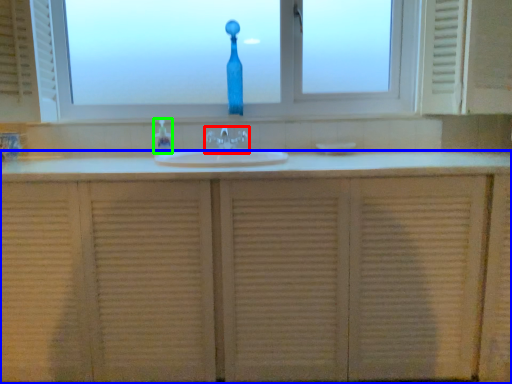
Question: Estimate the real-world distances between objects in this image. Which object is farther from tap (highlighted by a red box), bathroom cabinet (highlighted by a blue box) or soap dispenser (highlighted by a green box)?

Choices:
 (A) bathroom cabinet
 (B) soap dispenser

Answer: (A)